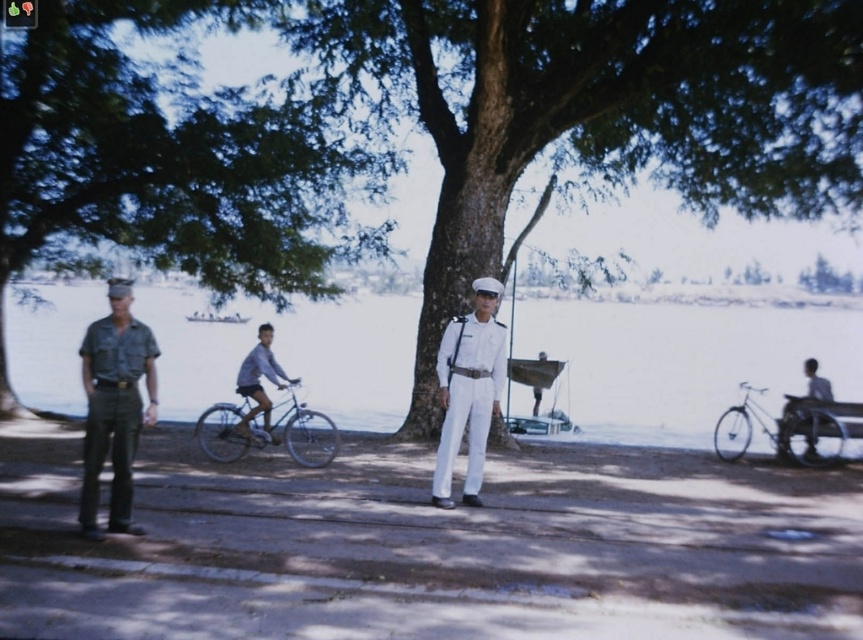
You are standing at the point marked by the coordinates point (167, 161). Which direction should you walk to avoid the tree?

The green leafy tree at upper left is represented by point (167, 161), so you should walk away from that point to avoid the tree.